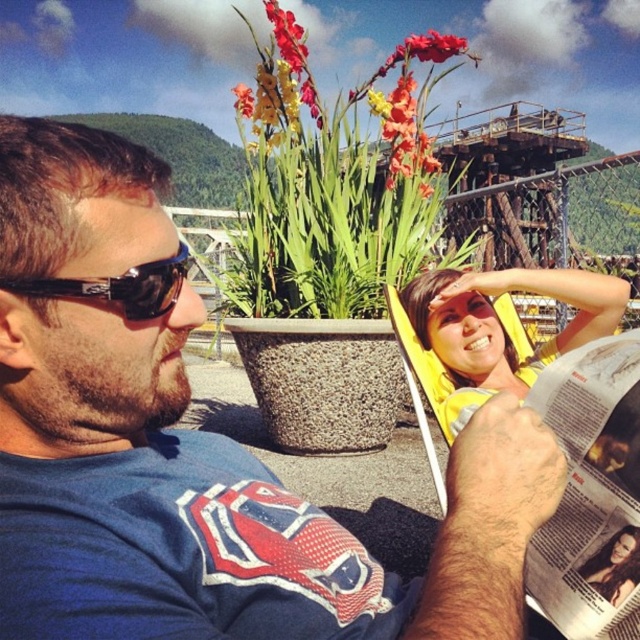
Which is more to the right, yellow fabric at upper center or vivid orange petals at center?

vivid orange petals at center is more to the right.

Is point (490, 353) positioned after point (429, 156)?

No.

This screenshot has height=640, width=640. Find the location of `yellow fabric at upper center`. yellow fabric at upper center is located at coordinates (493, 326).

Does blue fabric shirt at center come in front of smooth brown hair at center?

Yes, it is.

Does blue fabric shirt at center lie behind smooth brown hair at center?

No.

The width and height of the screenshot is (640, 640). Identify the location of blue fabric shirt at center. (193, 445).

Is blue fabric shirt at center closer to the viewer compared to vivid orange petals at center?

Yes, it is in front of vivid orange petals at center.

Between blue fabric shirt at center and vivid orange petals at center, which one appears on the right side from the viewer's perspective?

vivid orange petals at center

Does point (93, 163) come in front of point (406, 93)?

Yes, it is in front of point (406, 93).

Identify the location of blue fabric shirt at center. The image size is (640, 640). (193, 445).